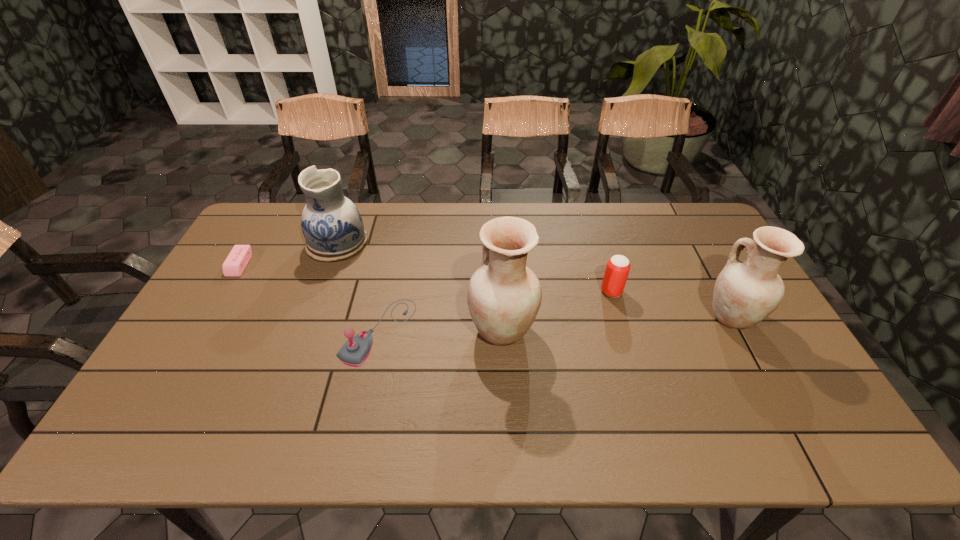
The potterys are evenly distributed in the image. To maintain this, where would you place another pottery on the left? Please point to a free space. Please provide its 2D coordinates. Your answer should be formatted as a tuple, i.e. [(x, y)], where the tuple contains the x and y coordinates of a point satisfying the conditions above.

[(260, 343)]